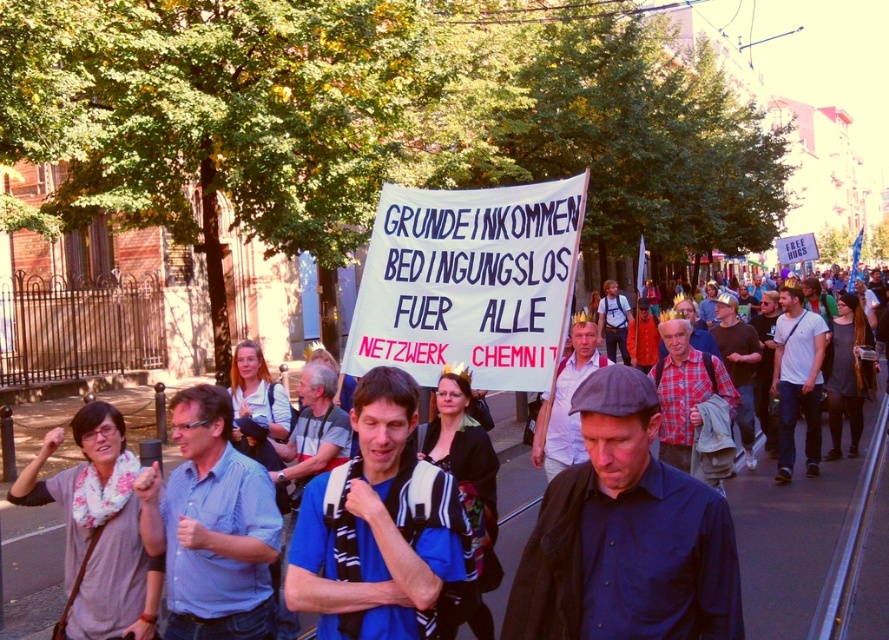
Question: Which point is closer to the camera?

Choices:
 (A) (745, 401)
 (B) (438, 496)

Answer: (B)

Question: Does plaid fabric shirt at center have a smaller size compared to dark blue shirt at center?

Choices:
 (A) no
 (B) yes

Answer: (B)

Question: Which point is farther to the camera?

Choices:
 (A) white cotton t-shirt at center
 (B) dark blue shirt at center
 (C) white paper sign at center
 (D) blue fabric backpack at center

Answer: (A)

Question: Which point is farther from the camera taking this photo?

Choices:
 (A) (721, 348)
 (B) (227, 515)
 (C) (310, 467)
 (D) (671, 557)

Answer: (A)

Question: Can you confirm if blue fabric shirt at center is positioned to the right of dark blue shirt at center?

Choices:
 (A) yes
 (B) no

Answer: (B)

Question: Does white cotton t-shirt at center have a greater width compared to blue fabric shirt at center?

Choices:
 (A) yes
 (B) no

Answer: (A)